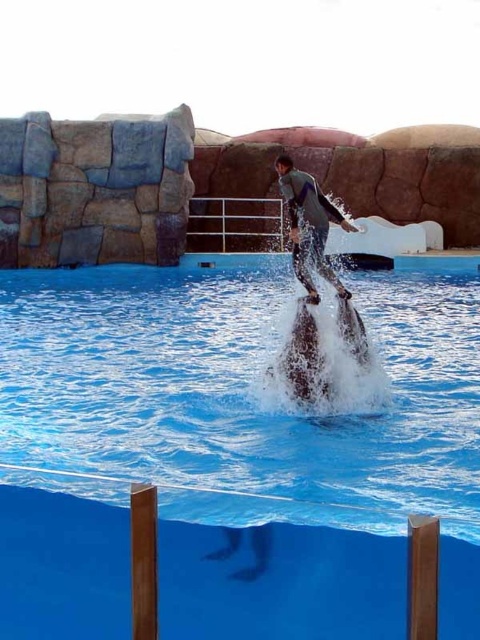
Is gray matte wetsuit at center above black glossy dolphin at center?

Yes.

Measure the distance between point (325, 236) and camera.

A distance of 39.43 feet exists between point (325, 236) and camera.

The height and width of the screenshot is (640, 480). What are the coordinates of `gray matte wetsuit at center` in the screenshot? It's located at (309, 225).

Can you confirm if blue smooth water at center is bigger than black glossy dolphin at center?

Indeed, blue smooth water at center has a larger size compared to black glossy dolphin at center.

Find the location of a particular element. The width and height of the screenshot is (480, 640). blue smooth water at center is located at coordinates (242, 394).

Describe the element at coordinates (242, 394) in the screenshot. I see `blue smooth water at center` at that location.

Does blue smooth water at center appear over smooth gray dolphin at center?

Yes.

What are the coordinates of `blue smooth water at center` in the screenshot? It's located at (242, 394).

I want to click on blue smooth water at center, so click(x=242, y=394).